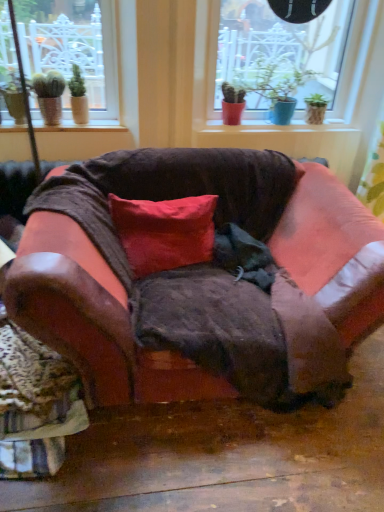
Identify the location of empty space that is to the right of matte brown pot at upper left. (102, 125).